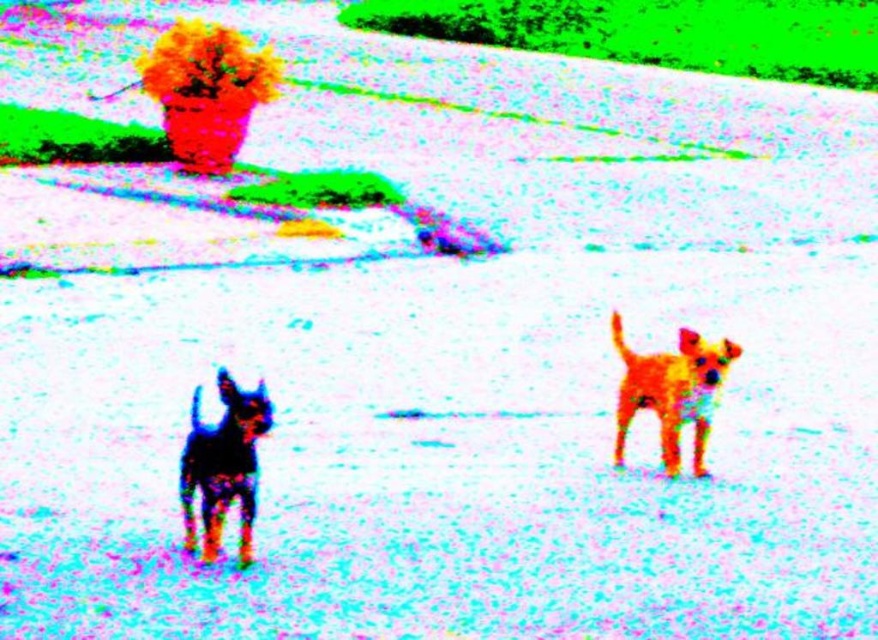
You are a photographer trying to capture a closeup shot of both the black glossy dog at left and the shiny golden dog at center. Given that your camera has a maximum focus range of 2 meters, will you be able to capture both dogs in the same frame without moving the camera?

The black glossy dog at left is 2.23 meters away from the shiny golden dog at center. Since the distance between them exceeds the camera maximum focus range of 2 meters, you cannot capture both dogs in the same frame without moving the camera.

You are a photographer trying to capture the two dogs in the scene. The black glossy dog at left and the shiny golden dog at center are both in your frame. If you want to ensure both dogs are fully visible without cropping, which dog should you adjust your camera to focus on to account for their size difference?

The black glossy dog at left is smaller in width than the shiny golden dog at center. To ensure both are fully visible, focus on the shiny golden dog at center since it is larger and requires more space in the frame.

You are a photographer trying to capture a photo of the black glossy dog at left and the shiny golden dog at center. Since the image is heavily edited with unnatural colors, you want to ensure the dogs are positioned correctly. Based on the scene description, which dog is positioned to the left of the other?

The black glossy dog at left is positioned to the left of the shiny golden dog at center.